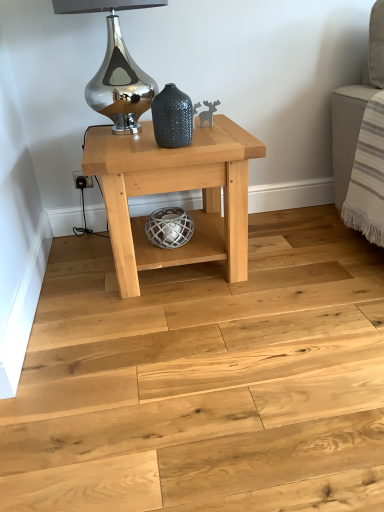
Question: Is natural wood floor at center in front of textured dark gray vase at center?

Choices:
 (A) yes
 (B) no

Answer: (A)

Question: Can you confirm if natural wood floor at center is smaller than textured dark gray vase at center?

Choices:
 (A) no
 (B) yes

Answer: (A)

Question: Does natural wood floor at center have a greater height compared to textured dark gray vase at center?

Choices:
 (A) yes
 (B) no

Answer: (B)

Question: Is natural wood floor at center beside textured dark gray vase at center?

Choices:
 (A) no
 (B) yes

Answer: (A)

Question: Considering the relative sizes of natural wood floor at center and textured dark gray vase at center in the image provided, is natural wood floor at center wider than textured dark gray vase at center?

Choices:
 (A) yes
 (B) no

Answer: (A)

Question: From the image's perspective, relative to natural wood table at center, is textured dark gray vase at center above or below?

Choices:
 (A) below
 (B) above

Answer: (B)

Question: Considering the positions of point (185, 125) and point (160, 180), is point (185, 125) closer or farther from the camera than point (160, 180)?

Choices:
 (A) farther
 (B) closer

Answer: (B)

Question: Considering the positions of textured dark gray vase at center and natural wood table at center in the image, is textured dark gray vase at center wider or thinner than natural wood table at center?

Choices:
 (A) wide
 (B) thin

Answer: (B)

Question: From a real-world perspective, is textured dark gray vase at center above or below natural wood table at center?

Choices:
 (A) below
 (B) above

Answer: (B)

Question: From the image's perspective, relative to textured dark gray vase at center, is natural wood table at center above or below?

Choices:
 (A) below
 (B) above

Answer: (A)

Question: Is natural wood table at center inside the boundaries of textured dark gray vase at center, or outside?

Choices:
 (A) outside
 (B) inside

Answer: (A)

Question: From a real-world perspective, is natural wood table at center physically located above or below textured dark gray vase at center?

Choices:
 (A) below
 (B) above

Answer: (A)

Question: Looking at the image, does natural wood table at center seem bigger or smaller compared to textured dark gray vase at center?

Choices:
 (A) big
 (B) small

Answer: (A)

Question: In terms of size, does natural wood table at center appear bigger or smaller than natural wood floor at center?

Choices:
 (A) small
 (B) big

Answer: (B)

Question: From the image's perspective, is natural wood table at center located above or below natural wood floor at center?

Choices:
 (A) above
 (B) below

Answer: (A)